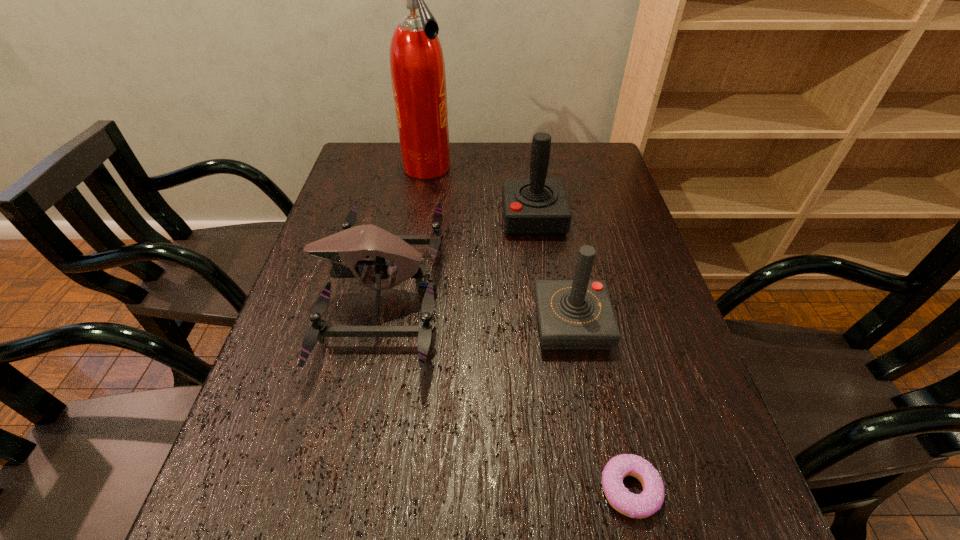
Identify the location of joystick present at the right edge. The height and width of the screenshot is (540, 960). (577, 314).

The image size is (960, 540). What are the coordinates of `doughnut that is at the right edge` in the screenshot? It's located at (643, 505).

Identify the location of object that is at the near right corner. (643, 505).

In the image, there is a desktop. Where is `vacant space at the far edge`? The height and width of the screenshot is (540, 960). vacant space at the far edge is located at coordinates (474, 149).

You are a GUI agent. You are given a task and a screenshot of the screen. Output one action in this format:
    pyautogui.click(x=<x>, y=<y>)
    Task: Click on the vacant area at the left edge of the desktop
    
    Given the screenshot: What is the action you would take?
    pyautogui.click(x=350, y=195)

In the image, there is a desktop. Where is `vacant space at the right edge`? The height and width of the screenshot is (540, 960). vacant space at the right edge is located at coordinates (674, 337).

Find the location of a particular element. The image size is (960, 540). vacant space at the far right corner of the desktop is located at coordinates click(x=586, y=176).

Where is `free space between the shortest object and the nearer joystick`? free space between the shortest object and the nearer joystick is located at coordinates (601, 407).

Where is `unoccupied position between the shorter joystick and the shortest object`? This screenshot has height=540, width=960. unoccupied position between the shorter joystick and the shortest object is located at coordinates (601, 407).

Locate an element on the screen. vacant point located between the drone and the doughnut is located at coordinates (506, 392).